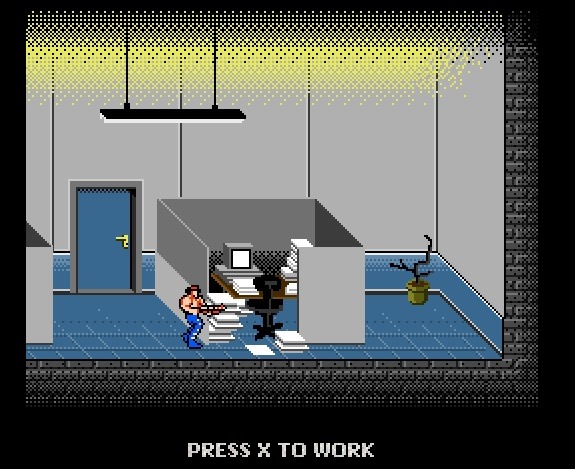
Find the location of a particular element. This screenshot has width=575, height=469. blue door is located at coordinates (111, 208), (87, 214), (97, 273), (110, 276).